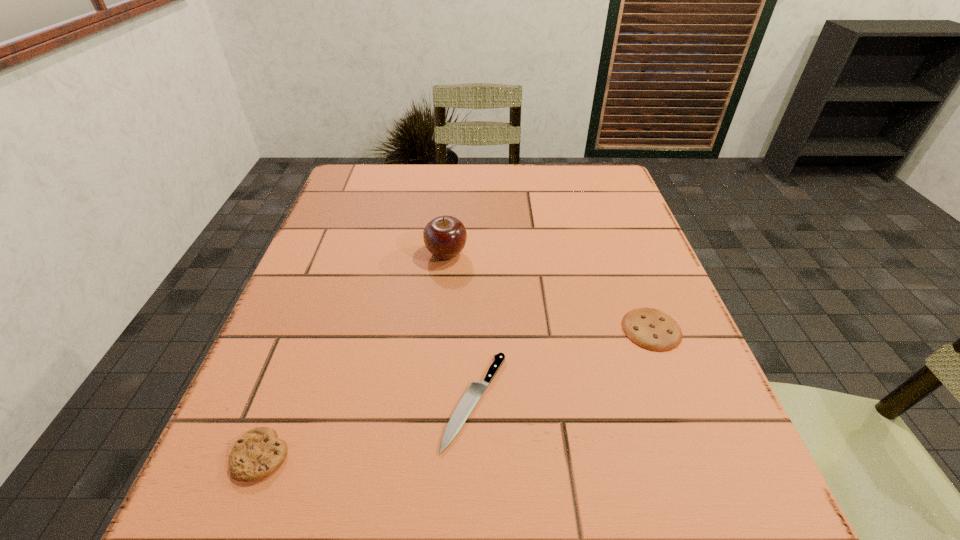
Identify the location of vacant region between the leftmost object and the tallest object. This screenshot has width=960, height=540. (353, 355).

The height and width of the screenshot is (540, 960). I want to click on the third closest object to the farthest object, so click(258, 453).

Choose which object is the third nearest neighbor to the steak knife. Please provide its 2D coordinates. Your answer should be formatted as a tuple, i.e. [(x, y)], where the tuple contains the x and y coordinates of a point satisfying the conditions above.

[(445, 236)]

I want to click on free spot that satisfies the following two spatial constraints: 1. on the back side of the farthest object; 2. on the left side of the left cookie, so click(x=338, y=254).

Find the location of a particular element. The width and height of the screenshot is (960, 540). vacant space that satisfies the following two spatial constraints: 1. on the front side of the apple; 2. on the right side of the farther cookie is located at coordinates (440, 329).

The width and height of the screenshot is (960, 540). Identify the location of free space that satisfies the following two spatial constraints: 1. on the back side of the leftmost object; 2. on the left side of the steak knife. (282, 401).